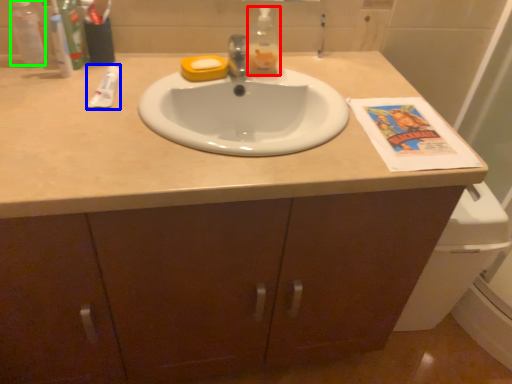
Question: Estimate the real-world distances between objects in this image. Which object is farther from bottle (highlighted by a red box), toothpaste (highlighted by a blue box) or bottle (highlighted by a green box)?

Choices:
 (A) toothpaste
 (B) bottle

Answer: (B)